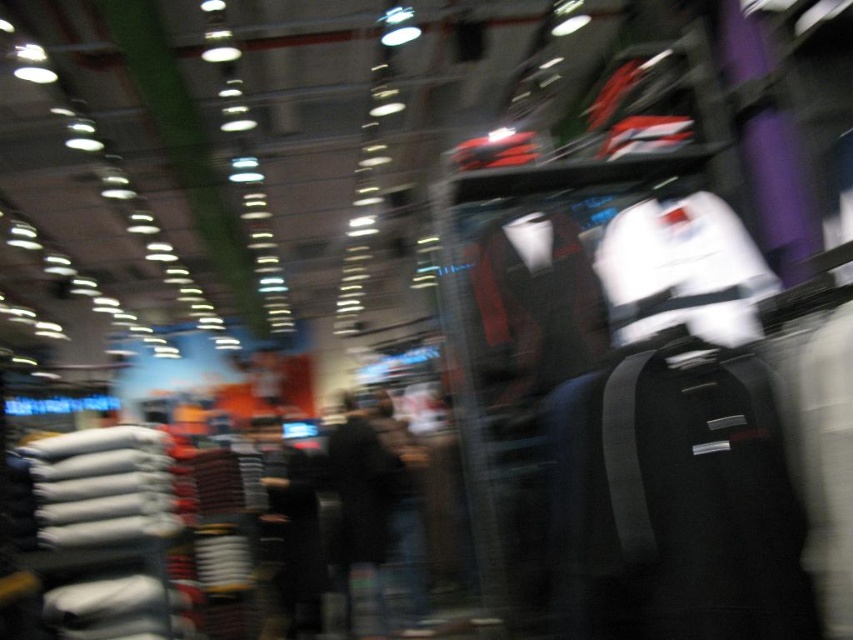
Question: Which object is positioned farthest from the dark gray fabric pants at center?

Choices:
 (A) black fabric jacket at center
 (B) velvet-like red jacket at center
 (C) white matte jacket at upper center

Answer: (C)

Question: Which object is positioned closest to the white matte jacket at upper center?

Choices:
 (A) black fabric jacket at center
 (B) black fabric bag at right

Answer: (B)

Question: Is white matte jacket at upper center below dark gray fabric pants at center?

Choices:
 (A) no
 (B) yes

Answer: (A)

Question: Is the position of black fabric bag at right more distant than that of velvet-like red jacket at center?

Choices:
 (A) no
 (B) yes

Answer: (A)

Question: Which object appears closest to the camera in this image?

Choices:
 (A) white matte jacket at upper center
 (B) velvet-like red jacket at center
 (C) dark gray fabric pants at center

Answer: (A)

Question: In this image, where is white matte jacket at upper center located relative to dark gray fabric pants at center?

Choices:
 (A) below
 (B) above

Answer: (B)